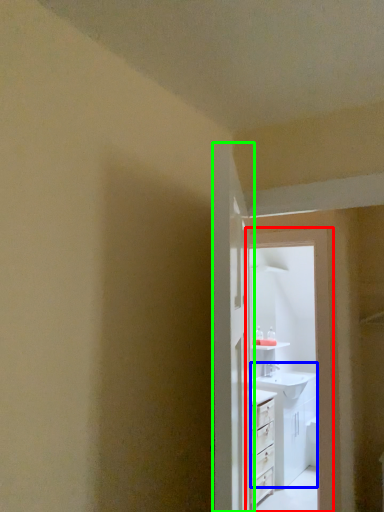
Question: Which is farther away from screen door (highlighted by a red box)? sink (highlighted by a blue box) or door (highlighted by a green box)?

Choices:
 (A) sink
 (B) door

Answer: (A)